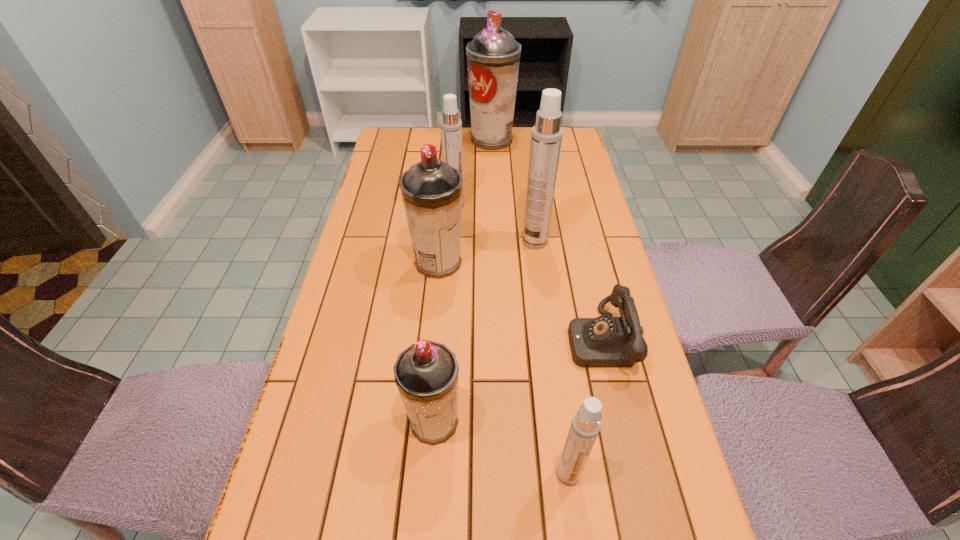
The width and height of the screenshot is (960, 540). What are the coordinates of `gray telephone` in the screenshot? It's located at (606, 341).

You are a GUI agent. You are given a task and a screenshot of the screen. Output one action in this format:
    pyautogui.click(x=<x>, y=<y>)
    Task: Click on the rightmost object
    This screenshot has width=960, height=540.
    Given the screenshot: What is the action you would take?
    pyautogui.click(x=606, y=341)

Locate an element on the screen. This screenshot has width=960, height=540. vacant area situated 0.330m on the front of the farthest aerosol can is located at coordinates 494,205.

Image resolution: width=960 pixels, height=540 pixels. In order to click on free space located 0.370m on the back of the second nearest white aerosol can in this screenshot , I will do `click(525, 167)`.

In order to click on vacant space located on the back of the second biggest gray aerosol can in this screenshot , I will do click(x=447, y=170).

Where is `vacant space located on the right of the leftmost white aerosol can`? Image resolution: width=960 pixels, height=540 pixels. vacant space located on the right of the leftmost white aerosol can is located at coordinates (553, 205).

Identify the location of free location located 0.080m on the left of the smallest white aerosol can. This screenshot has height=540, width=960. (515, 474).

Locate an element on the screen. The height and width of the screenshot is (540, 960). vacant space located 0.250m on the back of the second nearest object is located at coordinates (443, 309).

The width and height of the screenshot is (960, 540). Identify the location of vacant space located 0.270m on the dial of the telephone. (457, 340).

The image size is (960, 540). In order to click on vacant region located on the dial of the telephone in this screenshot , I will do `click(432, 340)`.